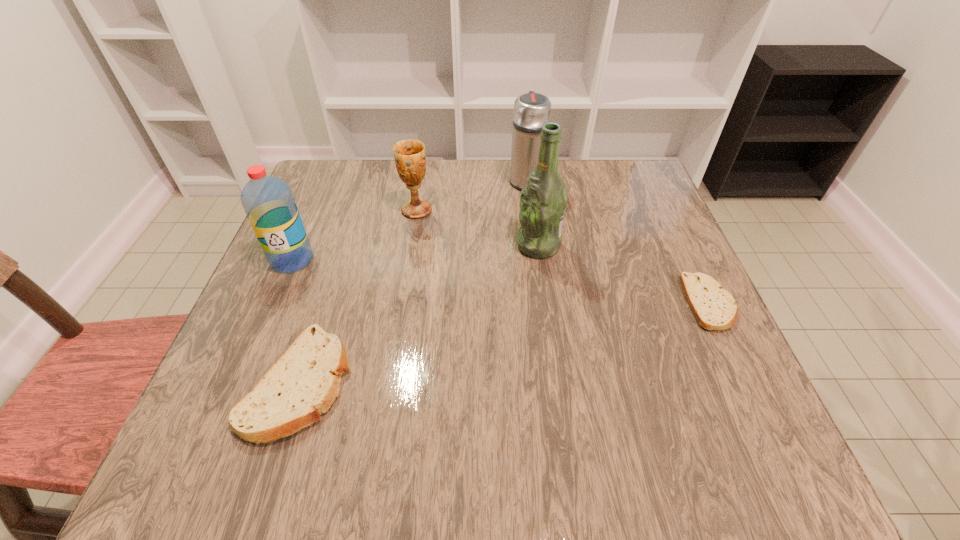
What are the coordinates of `vacant space located 0.190m on the left of the shortest object` in the screenshot? It's located at (592, 303).

Find the location of a particular element. The image size is (960, 540). blank space located on the right of the chalice is located at coordinates (476, 210).

At what (x,y) coordinates should I click in order to perform the action: click on vacant space located on the surface of the beer bottle. Please return your answer as a coordinate pair (x, y). Looking at the image, I should click on (464, 245).

Find the location of a particular element. The image size is (960, 540). free space located on the surface of the beer bottle is located at coordinates (376, 245).

Where is `vacant position located 0.080m on the surface of the beer bottle`? This screenshot has width=960, height=540. vacant position located 0.080m on the surface of the beer bottle is located at coordinates (481, 245).

The height and width of the screenshot is (540, 960). What are the coordinates of `vacant space located on the front label of the water bottle` in the screenshot? It's located at (231, 403).

Find the location of `thermos bottle present at the far edge`. thermos bottle present at the far edge is located at coordinates (532, 110).

Where is `chalice that is at the far edge`? chalice that is at the far edge is located at coordinates (410, 159).

This screenshot has height=540, width=960. Find the location of `object that is at the near edge`. object that is at the near edge is located at coordinates (304, 382).

Where is `pita bread at the left edge`? Image resolution: width=960 pixels, height=540 pixels. pita bread at the left edge is located at coordinates (304, 382).